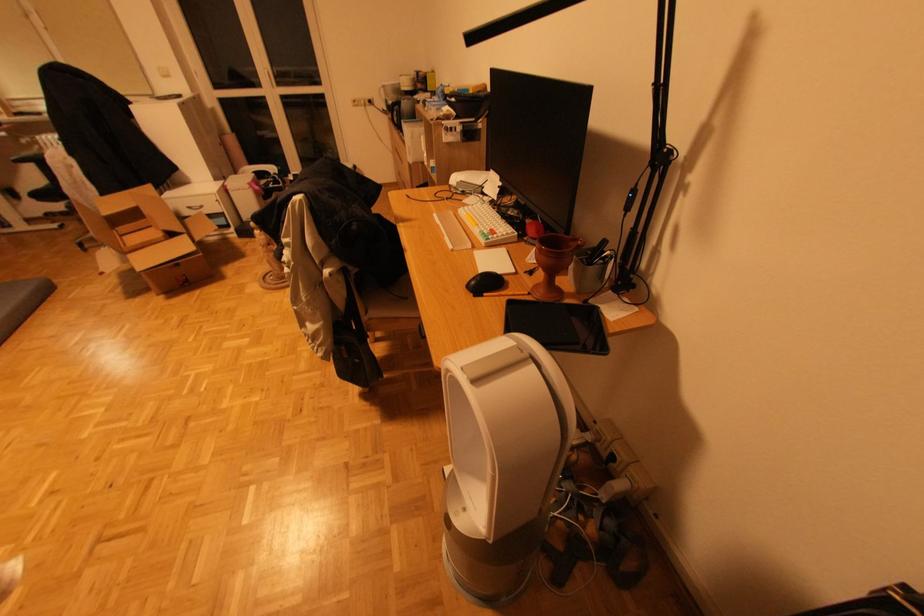
Identify the location of white drawer handle. This screenshot has height=616, width=924. (193, 207).